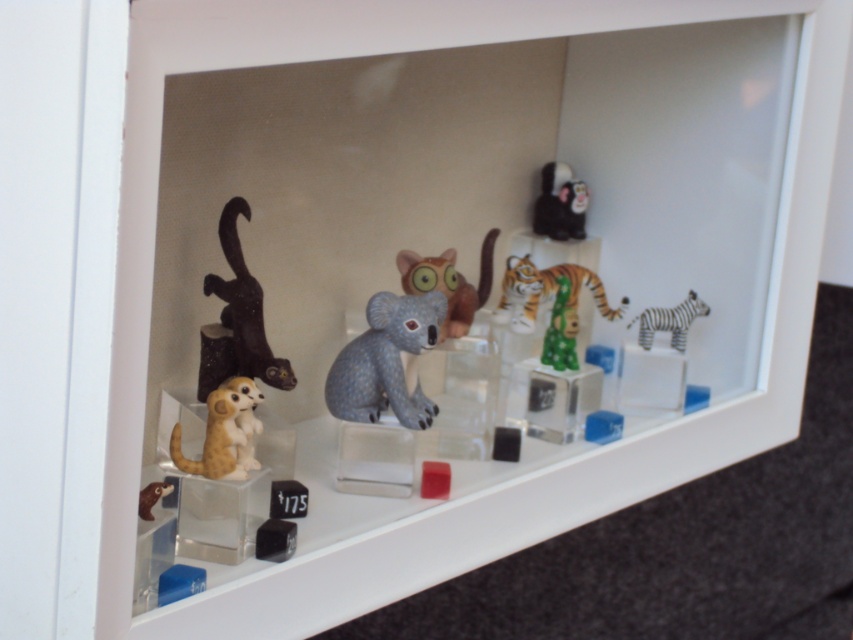
Question: Is shiny brown cat at left smaller than striped fur tiger at center?

Choices:
 (A) yes
 (B) no

Answer: (A)

Question: Can you confirm if shiny brown cat at left is thinner than brown matte figurine at lower left?

Choices:
 (A) no
 (B) yes

Answer: (A)

Question: Does shiny brown cat at left have a greater width compared to matte ceramic cat at center?

Choices:
 (A) yes
 (B) no

Answer: (B)

Question: Among these points, which one is nearest to the camera?

Choices:
 (A) (216, 436)
 (B) (653, 308)

Answer: (A)

Question: Among these objects, which one is farthest from the camera?

Choices:
 (A) green glossy cube at center
 (B) brown matte figurine at lower left

Answer: (A)

Question: Which of the following is the farthest from the observer?

Choices:
 (A) textured gray koala at center
 (B) light brown plush meerkat at lower left
 (C) brown matte figurine at lower left

Answer: (A)